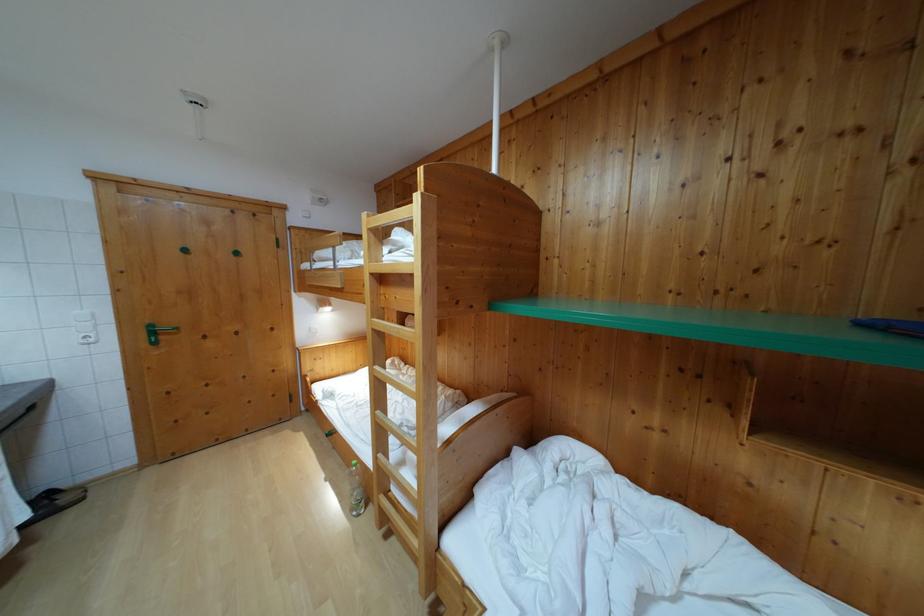
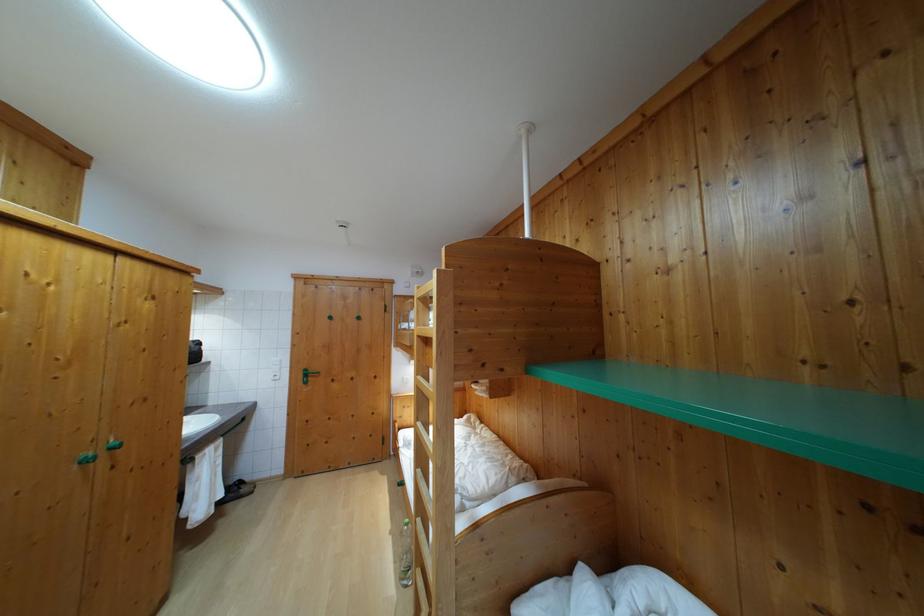
Where in the second image is the point corresponding to (x=374, y=282) from the first image?

(421, 342)